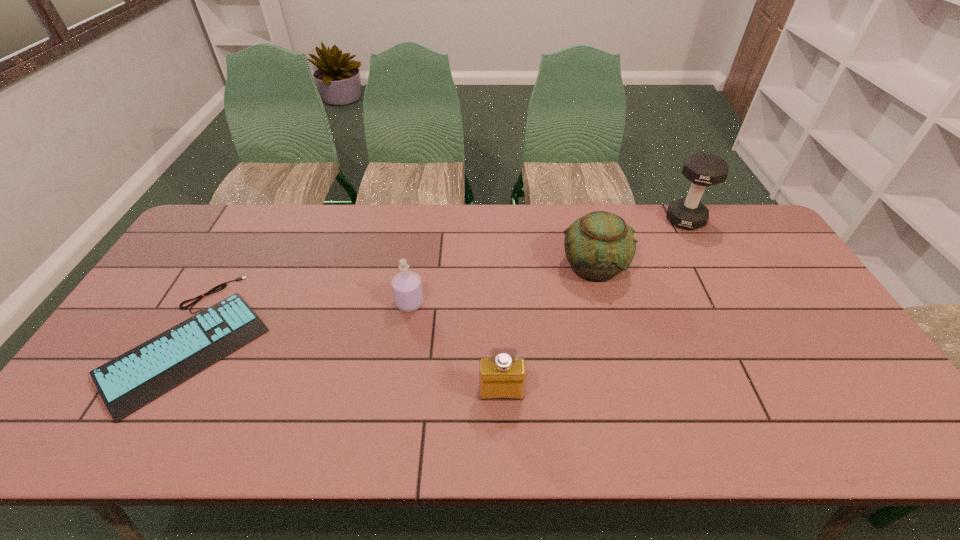
Where is `free region located on the left of the second object from right to left`? The image size is (960, 540). free region located on the left of the second object from right to left is located at coordinates (460, 267).

At what (x,y) coordinates should I click in order to perform the action: click on free space located 0.220m on the front of the left perfume. Please return your answer as a coordinate pair (x, y). Image resolution: width=960 pixels, height=540 pixels. Looking at the image, I should click on (397, 382).

At what (x,y) coordinates should I click in order to perform the action: click on free spot located 0.080m on the front-facing side of the right perfume. Please return your answer as a coordinate pair (x, y). Looking at the image, I should click on (503, 434).

Identify the location of vacant region located 0.300m on the right of the shortest object. (378, 340).

You are a GUI agent. You are given a task and a screenshot of the screen. Output one action in this format:
    pyautogui.click(x=<x>, y=<y>)
    Task: Click on the dumbbell present at the far edge
    
    Given the screenshot: What is the action you would take?
    pyautogui.click(x=702, y=169)

You are a GUI agent. You are given a task and a screenshot of the screen. Output one action in this format:
    pyautogui.click(x=<x>, y=<y>)
    Task: Click on the pottery at the far edge
    This screenshot has height=540, width=960.
    Given the screenshot: What is the action you would take?
    pyautogui.click(x=598, y=246)

The image size is (960, 540). I want to click on object positioned at the near edge, so click(x=128, y=382).

You are a GUI agent. You are given a task and a screenshot of the screen. Output one action in this format:
    pyautogui.click(x=<x>, y=<y>)
    Task: Click on the object that is at the left edge
    The width and height of the screenshot is (960, 540).
    Given the screenshot: What is the action you would take?
    pos(128,382)

You are a GUI agent. You are given a task and a screenshot of the screen. Output one action in this format:
    pyautogui.click(x=<x>, y=<y>)
    Task: Click on the object that is at the near left corner
    
    Given the screenshot: What is the action you would take?
    pyautogui.click(x=128, y=382)

This screenshot has height=540, width=960. Identify the location of free point at the far edge. (426, 241).